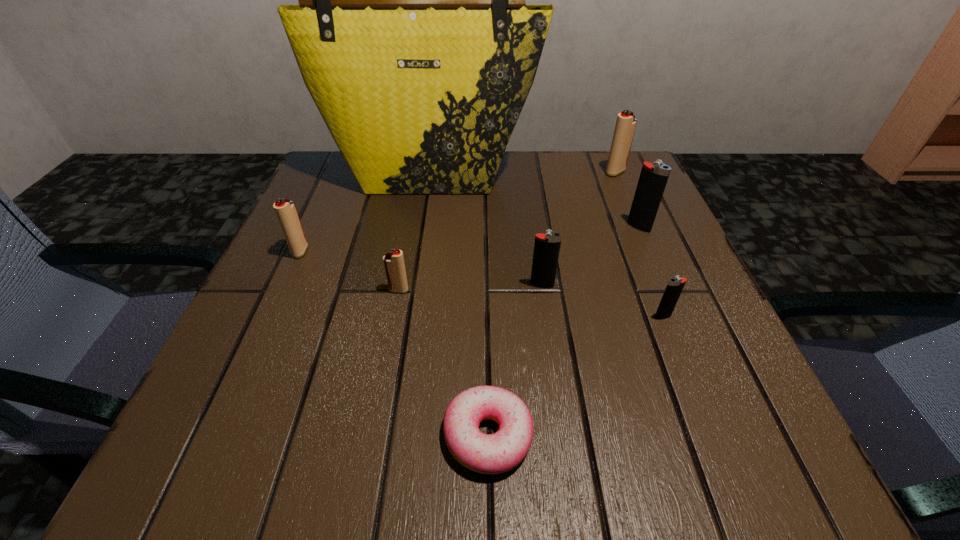
Identify the location of vacant area between the second farthest red igniter and the second farthest igniter. (469, 239).

Where is `vacant region between the yellow tote bag and the shortest object`? This screenshot has height=540, width=960. vacant region between the yellow tote bag and the shortest object is located at coordinates (459, 304).

The image size is (960, 540). I want to click on empty location between the leftmost igniter and the yellow tote bag, so click(366, 212).

The image size is (960, 540). Find the location of `empty space that is in between the second farthest red igniter and the smallest red igniter`. empty space that is in between the second farthest red igniter and the smallest red igniter is located at coordinates (349, 271).

Find the location of a particular element. The image size is (960, 540). vacant space in between the biggest black igniter and the nearest red igniter is located at coordinates (518, 259).

You are a GUI agent. You are given a task and a screenshot of the screen. Output one action in this format:
    pyautogui.click(x=<x>, y=<y>)
    Task: Click on the empty location between the tote bag and the nearest red igniter
    Image resolution: width=960 pixels, height=540 pixels.
    Given the screenshot: What is the action you would take?
    pyautogui.click(x=415, y=231)

Locate an element on the screen. object that is the third closest to the nearest object is located at coordinates (675, 285).

Identify which object is located as the third nearest to the farthest red igniter. Please provide its 2D coordinates. Your answer should be formatted as a tuple, i.e. [(x, y)], where the tuple contains the x and y coordinates of a point satisfying the conditions above.

[(547, 246)]

The width and height of the screenshot is (960, 540). Find the location of `igniter that can be found as the fourth closest to the rightmost red igniter`. igniter that can be found as the fourth closest to the rightmost red igniter is located at coordinates (394, 265).

Identify which igniter is the third closest to the second nearest object. Please provide its 2D coordinates. Your answer should be formatted as a tuple, i.e. [(x, y)], where the tuple contains the x and y coordinates of a point satisfying the conditions above.

[(394, 265)]